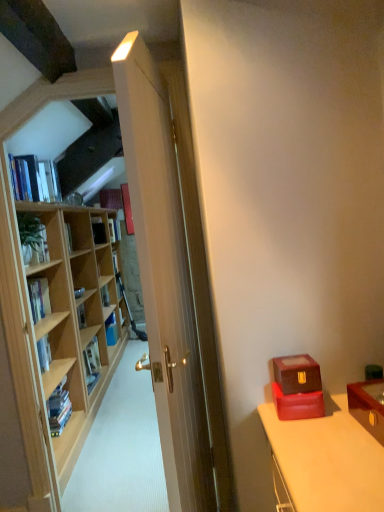
Question: Is hardcover book at left, which is the second book in front-to-back order, surrounded by hardcover book at center, the second book when ordered from back to front?

Choices:
 (A) no
 (B) yes

Answer: (A)

Question: From the image's perspective, is hardcover book at center, the second book when ordered from back to front, beneath hardcover book at left, placed as the ninth book when sorted from back to front?

Choices:
 (A) yes
 (B) no

Answer: (A)

Question: From the image's perspective, is hardcover book at center, which is the ninth book from front to back, over hardcover book at left, placed as the ninth book when sorted from back to front?

Choices:
 (A) yes
 (B) no

Answer: (B)

Question: Can you confirm if hardcover book at center, the second book when ordered from back to front, is shorter than hardcover book at left, placed as the ninth book when sorted from back to front?

Choices:
 (A) no
 (B) yes

Answer: (B)

Question: Does hardcover book at center, the second book when ordered from back to front, have a lesser width compared to hardcover book at left, placed as the ninth book when sorted from back to front?

Choices:
 (A) yes
 (B) no

Answer: (B)

Question: Is point (44, 256) closer or farther from the camera than point (71, 240)?

Choices:
 (A) closer
 (B) farther

Answer: (A)

Question: From the image's perspective, is green leafy plant at left above or below wooden bookshelf at left, the fifth book when ordered from back to front?

Choices:
 (A) above
 (B) below

Answer: (B)

Question: From a real-world perspective, is green leafy plant at left physically located above or below wooden bookshelf at left, arranged as the 6th book when viewed from the front?

Choices:
 (A) below
 (B) above

Answer: (B)

Question: Is green leafy plant at left to the left or to the right of wooden bookshelf at left, the fifth book when ordered from back to front, in the image?

Choices:
 (A) right
 (B) left

Answer: (A)

Question: Is hardcover book at center, arranged as the first book when viewed from the back, inside the boundaries of hardcover book at center, which is the ninth book from front to back, or outside?

Choices:
 (A) inside
 (B) outside

Answer: (B)

Question: Relative to hardcover book at center, the second book when ordered from back to front, is hardcover book at center, acting as the tenth book starting from the front, in front or behind?

Choices:
 (A) front
 (B) behind

Answer: (B)

Question: From a real-world perspective, is hardcover book at center, acting as the tenth book starting from the front, above or below hardcover book at center, which is the ninth book from front to back?

Choices:
 (A) above
 (B) below

Answer: (B)

Question: Is hardcover book at center, arranged as the first book when viewed from the back, taller or shorter than hardcover book at center, which is the ninth book from front to back?

Choices:
 (A) tall
 (B) short

Answer: (A)

Question: Based on their positions, is hardcover book at left, which is the second book in front-to-back order, located to the left or right of wooden bookshelf at left, arranged as the 6th book when viewed from the front?

Choices:
 (A) left
 (B) right

Answer: (B)

Question: Does point click(31, 302) appear closer or farther from the camera than point click(71, 245)?

Choices:
 (A) farther
 (B) closer

Answer: (B)